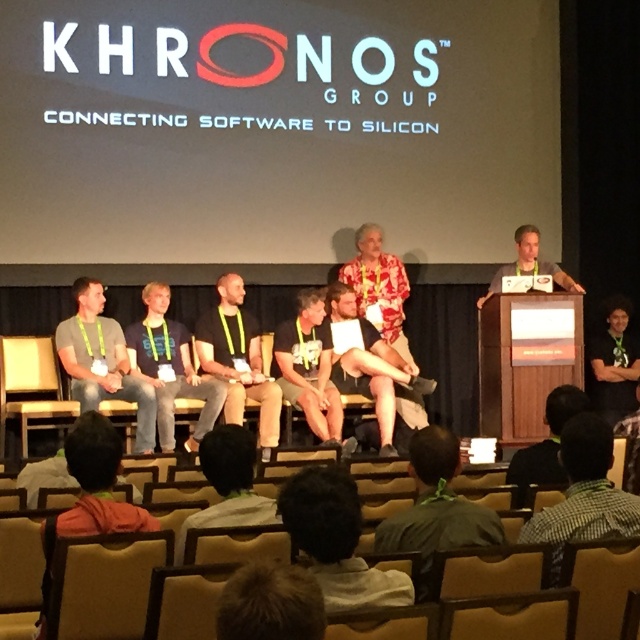
Does light brown leather jacket at lower center appear under dark brown wood podium at center?

Indeed, light brown leather jacket at lower center is positioned under dark brown wood podium at center.

Does light brown leather jacket at lower center lie in front of dark brown wood podium at center?

That is True.

What do you see at coordinates (228, 484) in the screenshot?
I see `light brown leather jacket at lower center` at bounding box center [228, 484].

Where is `light brown leather jacket at lower center`? light brown leather jacket at lower center is located at coordinates (228, 484).

Does green fabric shirt at lower center come behind gray casual shirt at left?

That is False.

Between green fabric shirt at lower center and gray casual shirt at left, which one appears on the right side from the viewer's perspective?

green fabric shirt at lower center

Is point (429, 433) farther from camera compared to point (88, 355)?

No, it is not.

The width and height of the screenshot is (640, 640). I want to click on green fabric shirt at lower center, so click(435, 509).

Is point (179, 348) closer to camera compared to point (282, 339)?

No, (179, 348) is further to viewer.

Identify the location of dark gray shirt at center. point(170,368).

Which is behind, point (168, 369) or point (300, 314)?

The point (300, 314) is behind.

Where is `dark gray shirt at center`? The image size is (640, 640). dark gray shirt at center is located at coordinates (170, 368).